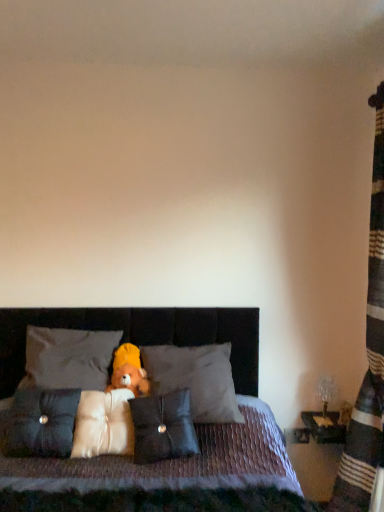
Question: From the image's perspective, would you say velvet-like brown bed at center is shown under dark gray fabric pillow at center, which is counted as the 5th pillow, starting from the left?

Choices:
 (A) no
 (B) yes

Answer: (B)

Question: From a real-world perspective, is velvet-like brown bed at center physically above dark gray fabric pillow at center, placed as the first pillow when sorted from right to left?

Choices:
 (A) yes
 (B) no

Answer: (B)

Question: Considering the relative positions of velvet-like brown bed at center and dark gray fabric pillow at center, which is counted as the 5th pillow, starting from the left, in the image provided, is velvet-like brown bed at center to the left of dark gray fabric pillow at center, which is counted as the 5th pillow, starting from the left, from the viewer's perspective?

Choices:
 (A) yes
 (B) no

Answer: (A)

Question: From the image's perspective, is velvet-like brown bed at center over dark gray fabric pillow at center, placed as the first pillow when sorted from right to left?

Choices:
 (A) yes
 (B) no

Answer: (B)

Question: Does velvet-like brown bed at center have a smaller size compared to dark gray fabric pillow at center, placed as the first pillow when sorted from right to left?

Choices:
 (A) no
 (B) yes

Answer: (A)

Question: Considering the positions of white soft pillow at center, positioned as the third pillow in right-to-left order, and soft plush teddy bear at center in the image, is white soft pillow at center, positioned as the third pillow in right-to-left order, taller or shorter than soft plush teddy bear at center?

Choices:
 (A) short
 (B) tall

Answer: (B)

Question: Considering the positions of white soft pillow at center, positioned as the third pillow in right-to-left order, and soft plush teddy bear at center in the image, is white soft pillow at center, positioned as the third pillow in right-to-left order, wider or thinner than soft plush teddy bear at center?

Choices:
 (A) wide
 (B) thin

Answer: (A)

Question: Is white soft pillow at center, positioned as the third pillow in right-to-left order, in front of or behind soft plush teddy bear at center in the image?

Choices:
 (A) front
 (B) behind

Answer: (A)

Question: Based on their positions, is white soft pillow at center, positioned as the third pillow in right-to-left order, located to the left or right of soft plush teddy bear at center?

Choices:
 (A) left
 (B) right

Answer: (A)

Question: Relative to black leather pillow at center, acting as the second pillow starting from the right, is white soft pillow at center, positioned as the third pillow in right-to-left order, in front or behind?

Choices:
 (A) behind
 (B) front

Answer: (A)

Question: From their relative heights in the image, would you say white soft pillow at center, positioned as the third pillow in right-to-left order, is taller or shorter than black leather pillow at center, acting as the second pillow starting from the right?

Choices:
 (A) short
 (B) tall

Answer: (A)

Question: From a real-world perspective, is white soft pillow at center, positioned as the third pillow in right-to-left order, physically located above or below black leather pillow at center, the fourth pillow when ordered from left to right?

Choices:
 (A) above
 (B) below

Answer: (B)

Question: Is white soft pillow at center, arranged as the 3th pillow when viewed from the left, bigger or smaller than black leather pillow at center, the fourth pillow when ordered from left to right?

Choices:
 (A) small
 (B) big

Answer: (A)

Question: Visually, is striped fabric curtain at right positioned to the left or to the right of soft plush teddy bear at center?

Choices:
 (A) left
 (B) right

Answer: (B)

Question: In terms of size, does striped fabric curtain at right appear bigger or smaller than soft plush teddy bear at center?

Choices:
 (A) small
 (B) big

Answer: (B)